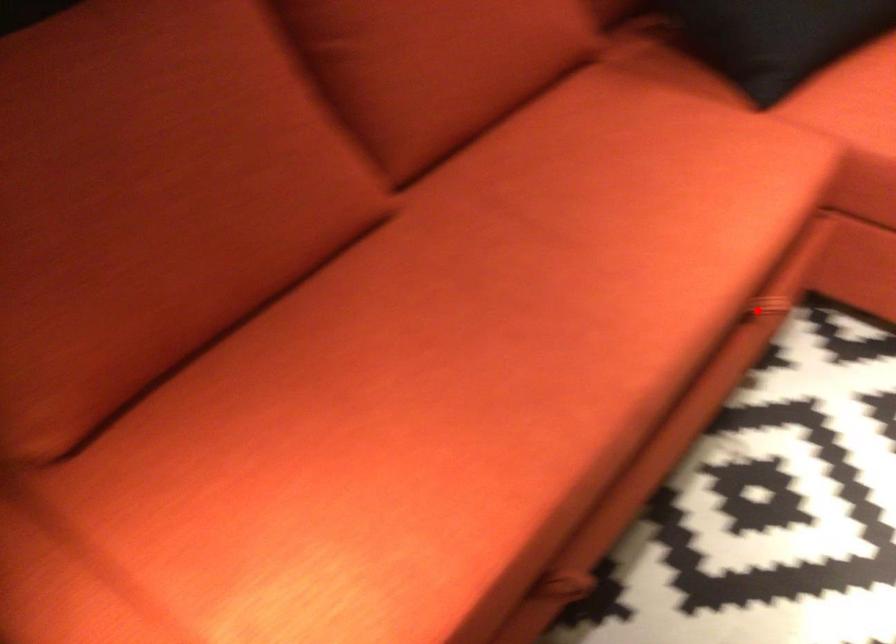
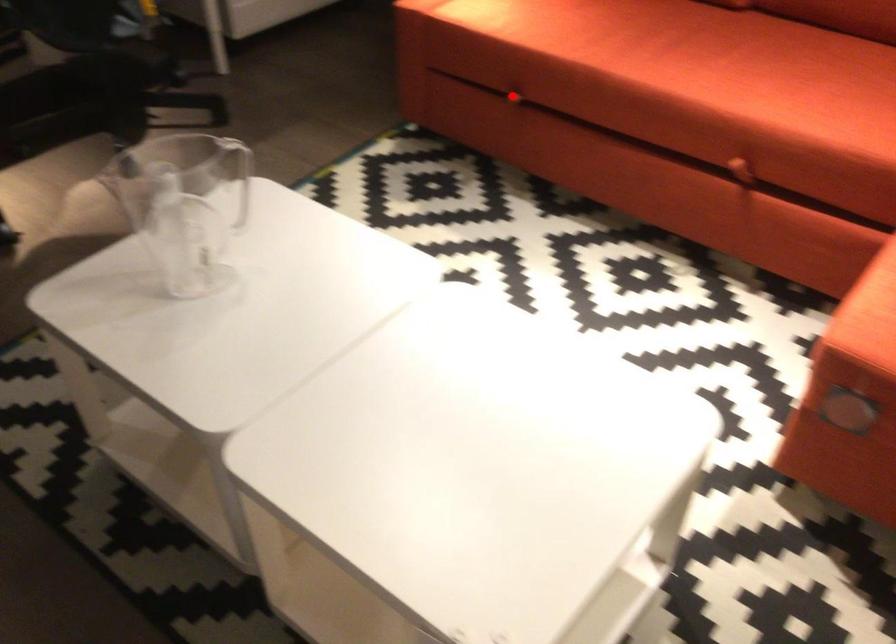
I am providing you with two images of the same scene from different viewpoints. A red point is marked on the first image and another point is marked on the second image. Is the red point in image1 aligned with the point shown in image2?

No